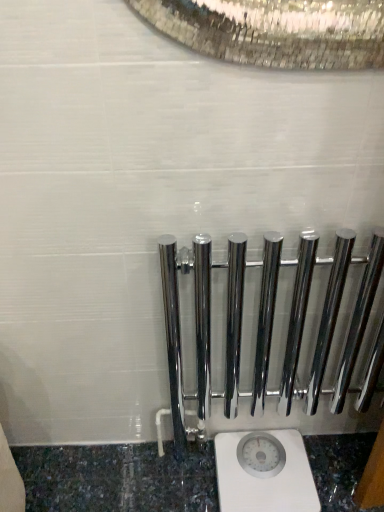
Question: Looking at the image, does polished chrome rail at center seem bigger or smaller compared to white plastic scale at lower center?

Choices:
 (A) small
 (B) big

Answer: (B)

Question: Would you say polished chrome rail at center is to the left or to the right of white plastic scale at lower center in the picture?

Choices:
 (A) left
 (B) right

Answer: (B)

Question: Considering their positions, is polished chrome rail at center located in front of or behind white plastic scale at lower center?

Choices:
 (A) behind
 (B) front

Answer: (B)

Question: In the image, is white plastic scale at lower center on the left side or the right side of polished chrome rail at center?

Choices:
 (A) left
 (B) right

Answer: (A)

Question: Considering their positions, is white plastic scale at lower center located in front of or behind polished chrome rail at center?

Choices:
 (A) front
 (B) behind

Answer: (B)

Question: From a real-world perspective, is white plastic scale at lower center physically located above or below polished chrome rail at center?

Choices:
 (A) below
 (B) above

Answer: (A)

Question: Is point (296, 455) closer or farther from the camera than point (359, 328)?

Choices:
 (A) closer
 (B) farther

Answer: (B)